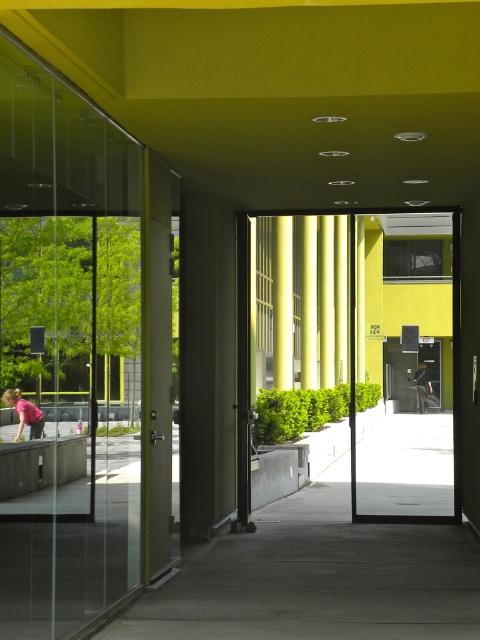
Question: Which object appears farthest from the camera in this image?

Choices:
 (A) pink fabric at lower left
 (B) yellow matte door at center
 (C) matte yellow door at center
 (D) black leather jacket at center

Answer: (D)

Question: Is matte yellow door at center positioned in front of pink fabric at lower left?

Choices:
 (A) no
 (B) yes

Answer: (B)

Question: Which object is closer to the camera taking this photo?

Choices:
 (A) yellow matte door at center
 (B) pink fabric at lower left
 (C) matte yellow door at center

Answer: (C)

Question: Is pink fabric at lower left thinner than black leather jacket at center?

Choices:
 (A) no
 (B) yes

Answer: (A)

Question: Which of the following is the closest to the observer?

Choices:
 (A) black leather jacket at center
 (B) matte yellow door at center
 (C) yellow matte door at center

Answer: (B)

Question: Is matte yellow door at center to the right of yellow matte door at center from the viewer's perspective?

Choices:
 (A) no
 (B) yes

Answer: (A)